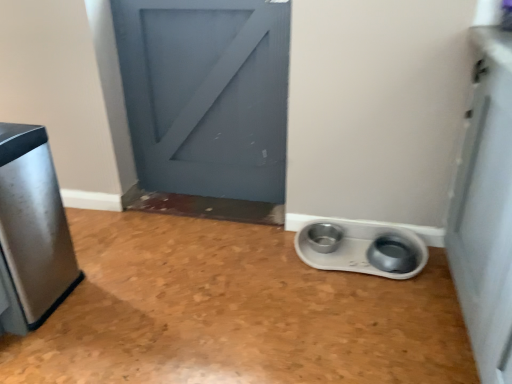
You are a GUI agent. You are given a task and a screenshot of the screen. Output one action in this format:
    pyautogui.click(x=<x>, y=<y>)
    Task: Click on the vacant area that lies between white plastic pet bowls at lower right and brushed metal trash can at left
    This screenshot has width=512, height=384.
    Given the screenshot: What is the action you would take?
    pyautogui.click(x=202, y=276)